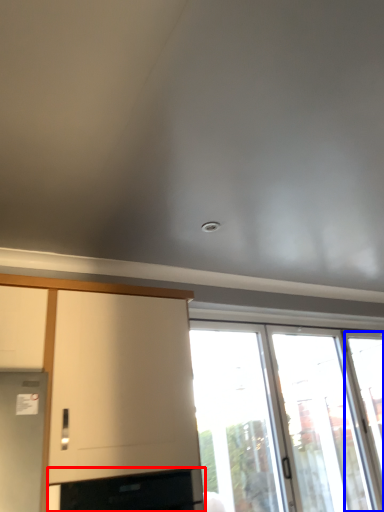
Question: Among these objects, which one is nearest to the camera, appliance (highlighted by a red box) or window (highlighted by a blue box)?

Choices:
 (A) appliance
 (B) window

Answer: (A)